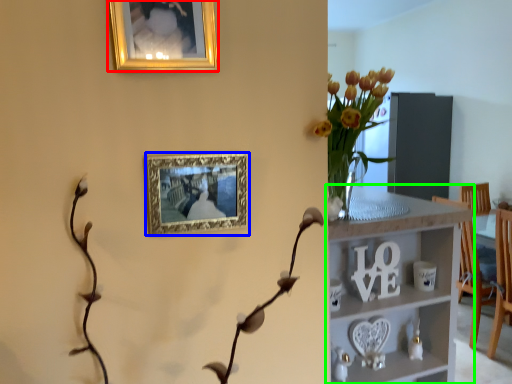
Question: Which is nearer to the picture frame (highlighted by a red box)? picture frame (highlighted by a blue box) or shelf (highlighted by a green box).

Choices:
 (A) picture frame
 (B) shelf

Answer: (A)